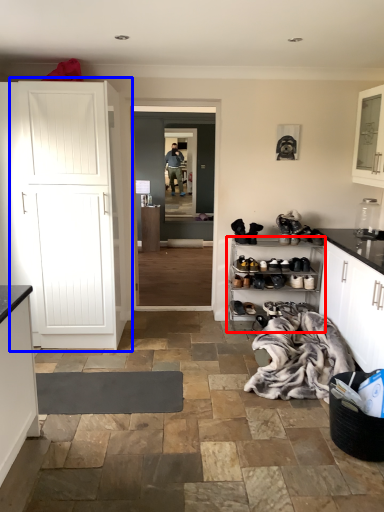
Question: Among these objects, which one is nearest to the camera, shelf (highlighted by a red box) or cupboard (highlighted by a blue box)?

Choices:
 (A) shelf
 (B) cupboard

Answer: (B)